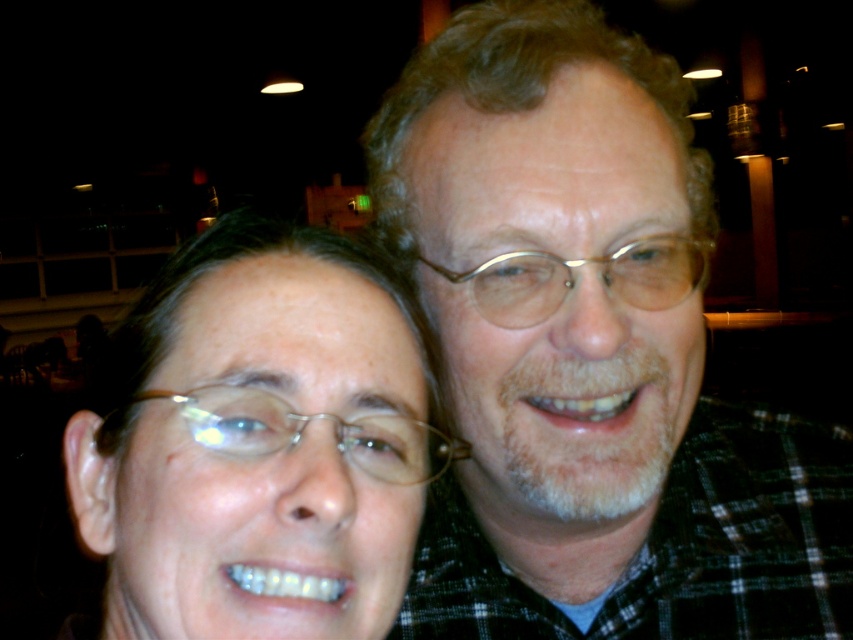
Is plaid shirt at center bigger than metallic gold glasses at center?

Yes.

Identify the location of plaid shirt at center. This screenshot has height=640, width=853. (589, 355).

Can you confirm if metallic silver glasses at center is positioned to the right of metallic gold glasses at center?

Incorrect, metallic silver glasses at center is not on the right side of metallic gold glasses at center.

Which is behind, point (271, 406) or point (538, 273)?

The point (538, 273) is more distant.

Image resolution: width=853 pixels, height=640 pixels. Describe the element at coordinates (300, 432) in the screenshot. I see `metallic silver glasses at center` at that location.

The height and width of the screenshot is (640, 853). I want to click on metallic silver glasses at center, so click(300, 432).

Can you confirm if matte gold glasses at center is shorter than metallic gold glasses at center?

Incorrect, matte gold glasses at center's height does not fall short of metallic gold glasses at center's.

Can you confirm if matte gold glasses at center is positioned to the right of metallic gold glasses at center?

Incorrect, matte gold glasses at center is not on the right side of metallic gold glasses at center.

Find the location of a particular element. The height and width of the screenshot is (640, 853). matte gold glasses at center is located at coordinates (259, 442).

The width and height of the screenshot is (853, 640). I want to click on matte gold glasses at center, so click(x=259, y=442).